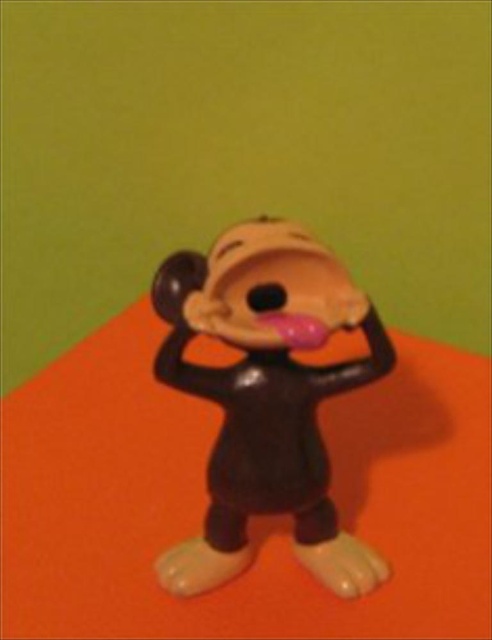
Looking at this image, can you confirm if orange matte table at center is thinner than matte plastic monkey at center?

Incorrect, orange matte table at center's width is not less than matte plastic monkey at center's.

Looking at this image, can you confirm if orange matte table at center is positioned to the left of matte plastic monkey at center?

Correct, you'll find orange matte table at center to the left of matte plastic monkey at center.

The image size is (492, 640). Describe the element at coordinates (251, 520) in the screenshot. I see `orange matte table at center` at that location.

The width and height of the screenshot is (492, 640). I want to click on orange matte table at center, so click(251, 520).